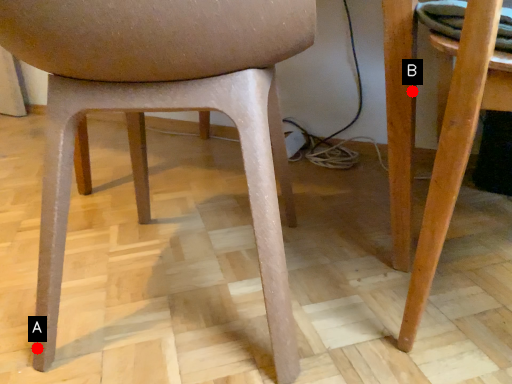
Question: Two points are circled on the image, labeled by A and B beside each circle. Which of the following is the closest to the observer?

Choices:
 (A) A is closer
 (B) B is closer

Answer: (A)